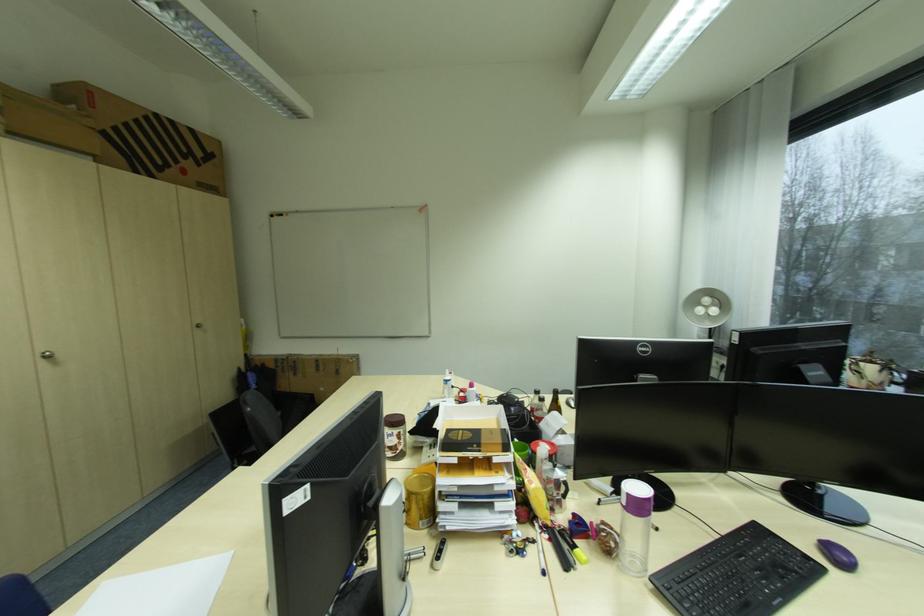
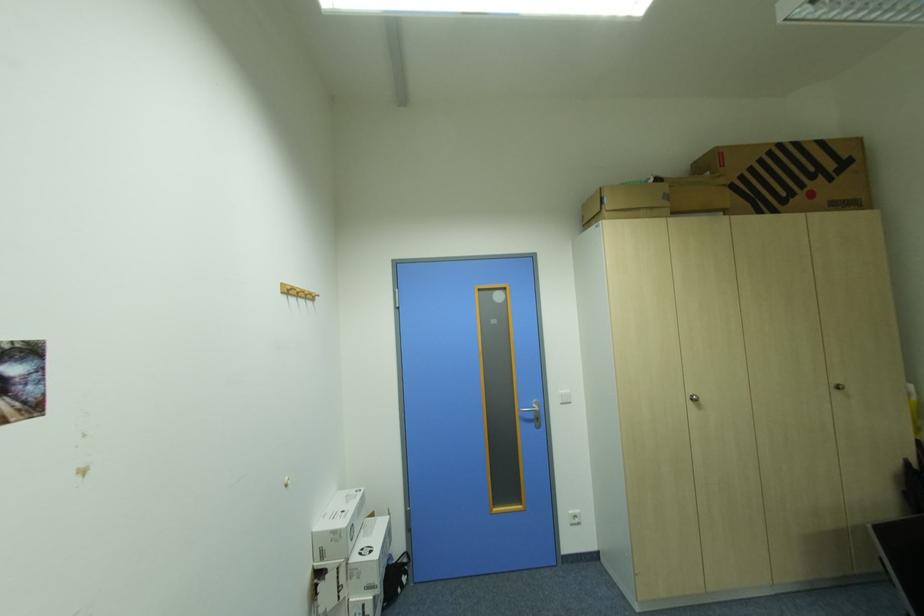
Find the pixel in the second image that matches point 202,326 in the first image.

(840, 386)